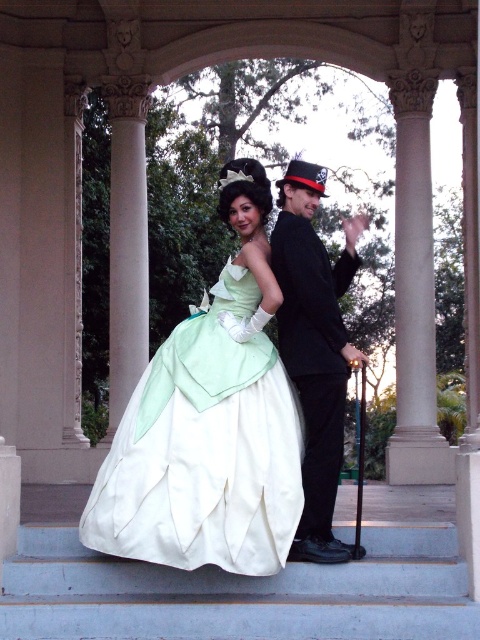
Question: Which object is farther from the camera taking this photo?

Choices:
 (A) linen-like green dress at center
 (B) shiny black suit at center
 (C) white smooth stairs at lower center

Answer: (B)

Question: Estimate the real-world distances between objects in this image. Which object is closer to the white smooth stairs at lower center?

Choices:
 (A) shiny black suit at center
 (B) linen-like green dress at center

Answer: (B)

Question: Can you confirm if linen-like green dress at center is positioned to the right of shiny black suit at center?

Choices:
 (A) no
 (B) yes

Answer: (A)

Question: Which of the following is the farthest from the observer?

Choices:
 (A) linen-like green dress at center
 (B) shiny black suit at center
 (C) white smooth stairs at lower center

Answer: (B)

Question: Does linen-like green dress at center appear on the left side of white smooth stairs at lower center?

Choices:
 (A) no
 (B) yes

Answer: (B)

Question: Is linen-like green dress at center bigger than shiny black suit at center?

Choices:
 (A) no
 (B) yes

Answer: (A)